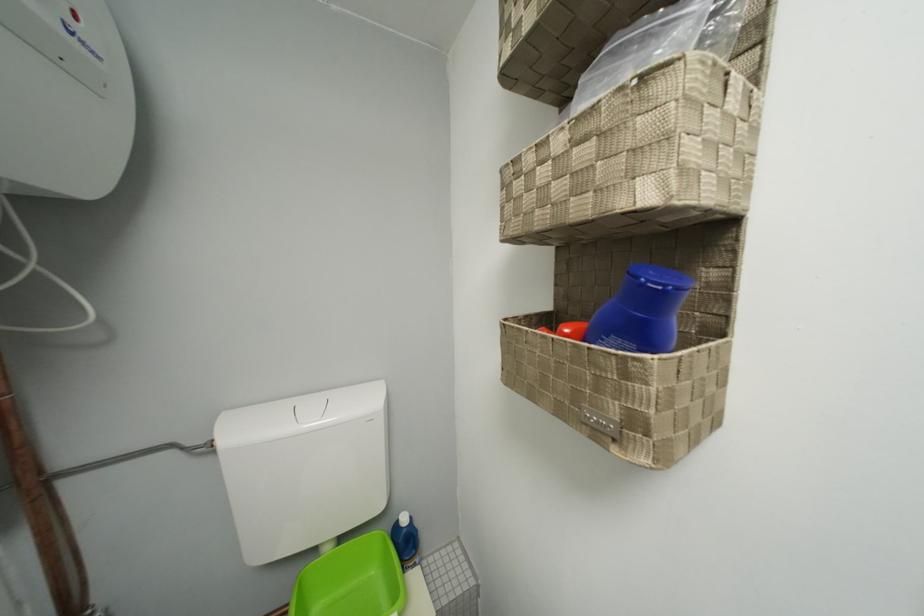
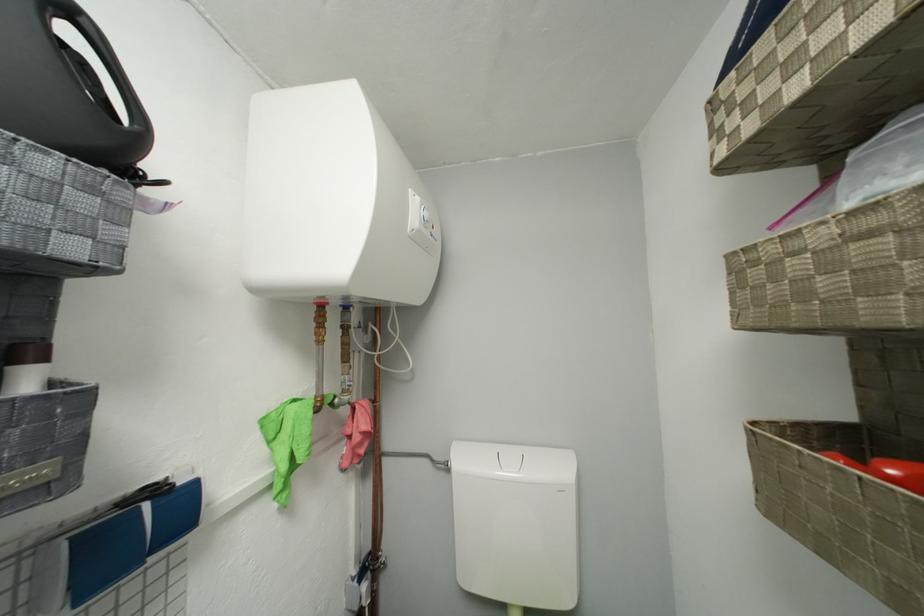
In the second image, find the point that corresponds to (x=523, y=329) in the first image.

(781, 442)